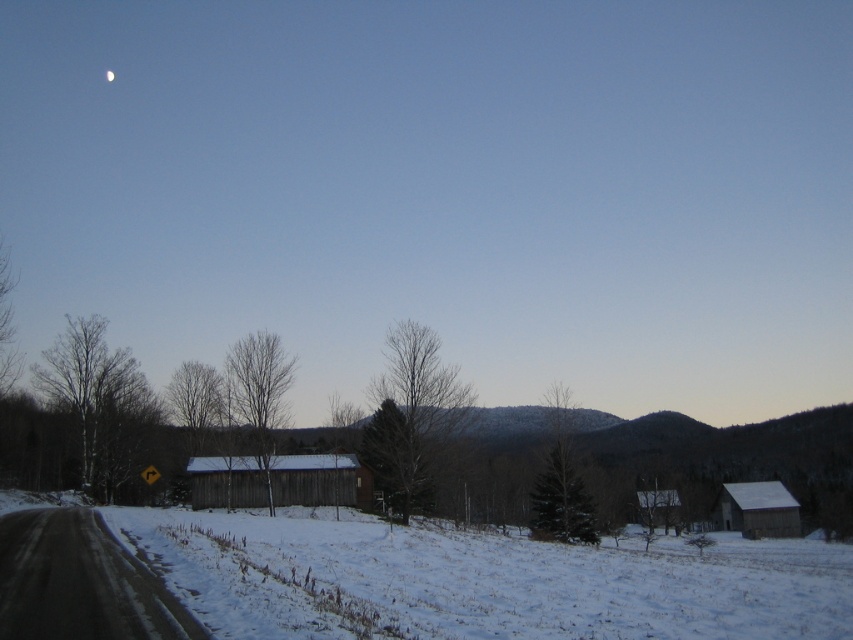
Question: Which object is farther from the camera taking this photo?

Choices:
 (A) white fluffy snow at lower center
 (B) white glossy moon at upper center

Answer: (B)

Question: From the image, what is the correct spatial relationship of white fluffy snow at lower center in relation to white glossy moon at upper center?

Choices:
 (A) below
 (B) above

Answer: (A)

Question: Can you confirm if white fluffy snow at lower center is thinner than white glossy moon at upper center?

Choices:
 (A) yes
 (B) no

Answer: (B)

Question: Does white fluffy snow at lower center have a greater width compared to white glossy moon at upper center?

Choices:
 (A) no
 (B) yes

Answer: (B)